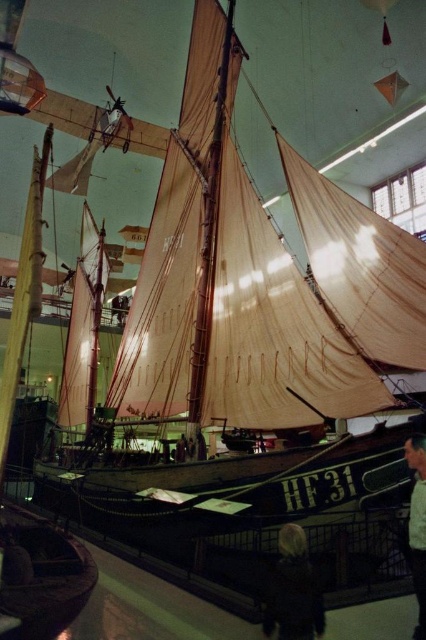
Is point (278, 593) closer to viewer compared to point (414, 531)?

No, (278, 593) is behind (414, 531).

Is dark hair at lower center to the left of light brown leather jacket at lower right from the viewer's perspective?

Indeed, dark hair at lower center is positioned on the left side of light brown leather jacket at lower right.

This screenshot has width=426, height=640. I want to click on dark hair at lower center, so click(x=293, y=589).